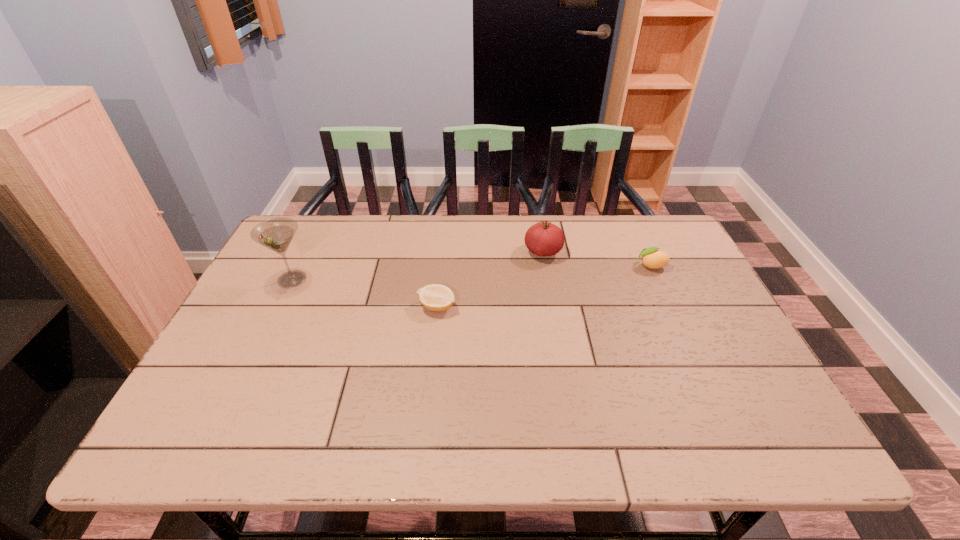
Identify the location of free space located with leaves positioned above the third tallest object. The width and height of the screenshot is (960, 540). (560, 266).

Where is `vacant space located with leaves positioned above the third tallest object`? The image size is (960, 540). vacant space located with leaves positioned above the third tallest object is located at coordinates (593, 266).

This screenshot has height=540, width=960. I want to click on vacant space located with leaves positioned above the third tallest object, so click(x=580, y=266).

Find the location of a particular element. This screenshot has width=960, height=540. vacant space situated on the front of the left lemon is located at coordinates (426, 414).

Identify the location of tomato that is at the far edge. (543, 238).

I want to click on lemon that is at the far edge, so click(x=653, y=258).

This screenshot has width=960, height=540. In order to click on object at the left edge in this screenshot , I will do `click(276, 234)`.

Locate an element on the screen. object present at the right edge is located at coordinates (653, 258).

Image resolution: width=960 pixels, height=540 pixels. What are the coordinates of `object at the far right corner` in the screenshot? It's located at (653, 258).

This screenshot has height=540, width=960. What are the coordinates of `vacant space at the far edge` in the screenshot? It's located at (500, 235).